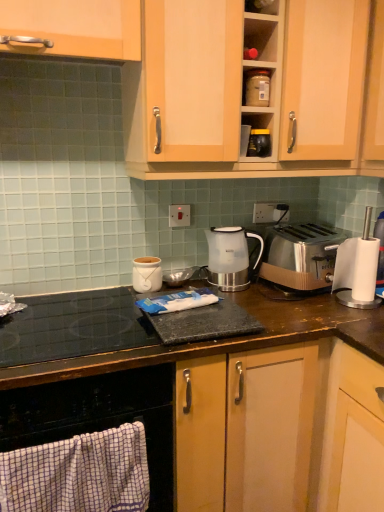
Measure the distance between point (75, 354) and camera.

The depth of point (75, 354) is 1.08 meters.

The width and height of the screenshot is (384, 512). Find the location of `black glass cooktop at lower left`. black glass cooktop at lower left is located at coordinates (73, 327).

Locate an element on the screen. The image size is (384, 512). black glass cooktop at lower left is located at coordinates (99, 416).

What do you see at coordinates (155, 336) in the screenshot? The width and height of the screenshot is (384, 512). I see `brown wood countertop at center` at bounding box center [155, 336].

The height and width of the screenshot is (512, 384). What do you see at coordinates (357, 269) in the screenshot?
I see `white plastic blender at right` at bounding box center [357, 269].

Looking at this image, what is the approximate width of wooden cabinet at upper center, which ranks as the 1th cabinetry in right-to-left order?

wooden cabinet at upper center, which ranks as the 1th cabinetry in right-to-left order, is 37.36 centimeters wide.

Image resolution: width=384 pixels, height=512 pixels. In order to click on satin silver outlet at center, acting as the 1th electric outlet starting from the back in this screenshot , I will do `click(270, 212)`.

Could matte plastic container at upper center, which ranks as the 1th kitchen appliance in right-to-left order, be considered to be inside white plastic blender at right?

No, matte plastic container at upper center, which ranks as the 1th kitchen appliance in right-to-left order, is located outside of white plastic blender at right.

From the image's perspective, which is below, white plastic blender at right or matte plastic container at upper center, which ranks as the 1th kitchen appliance in right-to-left order?

white plastic blender at right appears lower in the image.

Which of these two, white plastic blender at right or matte plastic container at upper center, which ranks as the 1th kitchen appliance in right-to-left order, is wider?

Wider between the two is white plastic blender at right.

Between white plastic blender at right and matte plastic container at upper center, which appears as the 3th kitchen appliance when viewed from the left, which one appears on the right side from the viewer's perspective?

Positioned to the right is white plastic blender at right.

Is satin silver toaster at right to the right of wooden cabinet handle at upper left, acting as the 2th cabinetry starting from the right, from the viewer's perspective?

Yes.

How far apart are satin silver toaster at right and wooden cabinet handle at upper left, acting as the 1th cabinetry starting from the left?

The distance of satin silver toaster at right from wooden cabinet handle at upper left, acting as the 1th cabinetry starting from the left, is 94.54 centimeters.

From a real-world perspective, relative to wooden cabinet handle at upper left, acting as the 1th cabinetry starting from the left, is satin silver toaster at right vertically above or below?

Clearly, from a real-world perspective, satin silver toaster at right is below wooden cabinet handle at upper left, acting as the 1th cabinetry starting from the left.

Who is taller, satin silver toaster at right or wooden cabinet handle at upper left, acting as the 2th cabinetry starting from the right?

wooden cabinet handle at upper left, acting as the 2th cabinetry starting from the right.

Would you say wooden cabinet at upper center, which ranks as the 2th cabinetry in left-to-right order, is inside or outside satin silver outlet at center, placed as the second electric outlet when sorted from left to right?

wooden cabinet at upper center, which ranks as the 2th cabinetry in left-to-right order, is outside satin silver outlet at center, placed as the second electric outlet when sorted from left to right.

Are wooden cabinet at upper center, which ranks as the 2th cabinetry in left-to-right order, and satin silver outlet at center, placed as the second electric outlet when sorted from left to right, located far from each other?

No, there isn't a large distance between wooden cabinet at upper center, which ranks as the 2th cabinetry in left-to-right order, and satin silver outlet at center, placed as the second electric outlet when sorted from left to right.

Is wooden cabinet at upper center, which ranks as the 1th cabinetry in right-to-left order, facing away from satin silver outlet at center, placed as the second electric outlet when sorted from left to right?

No, wooden cabinet at upper center, which ranks as the 1th cabinetry in right-to-left order, is not facing the opposite direction of satin silver outlet at center, placed as the second electric outlet when sorted from left to right.

Is matte plastic container at upper center, the third kitchen appliance in the bottom-to-top sequence, far away from matte white jar at center, acting as the first kitchen appliance starting from the bottom?

matte plastic container at upper center, the third kitchen appliance in the bottom-to-top sequence, is near matte white jar at center, acting as the first kitchen appliance starting from the bottom, not far away.

In terms of height, does matte plastic container at upper center, the third kitchen appliance in the bottom-to-top sequence, look taller or shorter compared to matte white jar at center, which appears as the 3th kitchen appliance when viewed from the right?

matte plastic container at upper center, the third kitchen appliance in the bottom-to-top sequence, is shorter than matte white jar at center, which appears as the 3th kitchen appliance when viewed from the right.

Between matte plastic container at upper center, which ranks as the 1th kitchen appliance in right-to-left order, and matte white jar at center, acting as the first kitchen appliance starting from the bottom, which one has smaller width?

matte plastic container at upper center, which ranks as the 1th kitchen appliance in right-to-left order, is thinner.

Looking at this image, is black glass cooktop at lower left positioned in front of matte plastic container at upper center, which ranks as the 1th kitchen appliance in right-to-left order?

Yes, it is in front of matte plastic container at upper center, which ranks as the 1th kitchen appliance in right-to-left order.

Considering the positions of objects black glass cooktop at lower left and matte plastic container at upper center, marked as the 1th kitchen appliance in a top-to-bottom arrangement, in the image provided, who is more to the left, black glass cooktop at lower left or matte plastic container at upper center, marked as the 1th kitchen appliance in a top-to-bottom arrangement,?

Positioned to the left is black glass cooktop at lower left.

Image resolution: width=384 pixels, height=512 pixels. There is a black glass cooktop at lower left. Identify the location of the 3rd kitchen appliance above it (from the image's perspective). (257, 87).

How far apart are black glass cooktop at lower left and matte plastic container at upper center, which ranks as the 1th kitchen appliance in right-to-left order?

black glass cooktop at lower left is 34.91 inches away from matte plastic container at upper center, which ranks as the 1th kitchen appliance in right-to-left order.

Locate an element on the screen. The width and height of the screenshot is (384, 512). the 2nd electric outlet behind the brown wood countertop at center, starting your count from the anchor is located at coordinates (270, 212).

Is satin silver outlet at center, placed as the second electric outlet when sorted from left to right, closer to the viewer compared to brown wood countertop at center?

No, it is behind brown wood countertop at center.

Is satin silver outlet at center, the 2th electric outlet in the front-to-back sequence, oriented away from brown wood countertop at center?

No.

In the scene shown: Can black glass cooktop at lower left be found inside wooden cabinet at upper center, which ranks as the 2th cabinetry in left-to-right order?

No, black glass cooktop at lower left is located outside of wooden cabinet at upper center, which ranks as the 2th cabinetry in left-to-right order.

Considering the positions of objects wooden cabinet at upper center, which ranks as the 1th cabinetry in right-to-left order, and black glass cooktop at lower left in the image provided, who is in front, wooden cabinet at upper center, which ranks as the 1th cabinetry in right-to-left order, or black glass cooktop at lower left?

black glass cooktop at lower left is in front.

Considering the relative sizes of wooden cabinet at upper center, which ranks as the 1th cabinetry in right-to-left order, and black glass cooktop at lower left in the image provided, is wooden cabinet at upper center, which ranks as the 1th cabinetry in right-to-left order, bigger than black glass cooktop at lower left?

Correct, wooden cabinet at upper center, which ranks as the 1th cabinetry in right-to-left order, is larger in size than black glass cooktop at lower left.

From the picture: How distant is wooden cabinet at upper center, which ranks as the 1th cabinetry in right-to-left order, from black glass cooktop at lower left?

wooden cabinet at upper center, which ranks as the 1th cabinetry in right-to-left order, and black glass cooktop at lower left are 27.01 inches apart.

What are the coordinates of `blender below the matte plastic container at upper center, which ranks as the 1th kitchen appliance in right-to-left order (from the image's perspective)` in the screenshot? It's located at (357, 269).

Where is `toaster behind the wooden cabinet handle at upper left, acting as the 1th cabinetry starting from the left`? The width and height of the screenshot is (384, 512). toaster behind the wooden cabinet handle at upper left, acting as the 1th cabinetry starting from the left is located at coordinates (301, 255).

Considering their positions, is satin silver outlet at center, placed as the second electric outlet when sorted from left to right, positioned further to white plastic electric outlet at center, the second electric outlet viewed from the right, than white plastic blender at right?

Based on the image, white plastic blender at right appears to be further to white plastic electric outlet at center, the second electric outlet viewed from the right.

When comparing their distances from satin silver outlet at center, placed as the second electric outlet when sorted from left to right, does white glossy electric kettle at center, the 2th kitchen appliance in the bottom-to-top sequence, or white plastic blender at right seem closer?

white glossy electric kettle at center, the 2th kitchen appliance in the bottom-to-top sequence.

Which object lies further to the anchor point wooden cabinet at upper center, which ranks as the 1th cabinetry in right-to-left order, wooden cabinet handle at upper left, acting as the 1th cabinetry starting from the left, or matte white jar at center, which appears as the 3th kitchen appliance when viewed from the right?

matte white jar at center, which appears as the 3th kitchen appliance when viewed from the right.

Based on their spatial positions, is black glass cooktop at lower left or black glass cooktop at lower left closer to wooden cabinet handle at upper left, acting as the 2th cabinetry starting from the right?

black glass cooktop at lower left lies closer to wooden cabinet handle at upper left, acting as the 2th cabinetry starting from the right, than the other object.

Which object lies nearer to the anchor point wooden cabinet at upper center, which ranks as the 2th cabinetry in left-to-right order, brown wood countertop at center or matte white jar at center, acting as the first kitchen appliance starting from the bottom?

brown wood countertop at center is closer to wooden cabinet at upper center, which ranks as the 2th cabinetry in left-to-right order.

When comparing their distances from wooden cabinet handle at upper left, acting as the 1th cabinetry starting from the left, does black glass cooktop at lower left or matte white jar at center, the first kitchen appliance when ordered from left to right, seem further?

The object further to wooden cabinet handle at upper left, acting as the 1th cabinetry starting from the left, is black glass cooktop at lower left.

When comparing their distances from white plastic electric outlet at center, positioned as the 1th electric outlet in front-to-back order, does wooden cabinet handle at upper left, acting as the 1th cabinetry starting from the left, or white glossy electric kettle at center, the second kitchen appliance positioned from the right, seem closer?

white glossy electric kettle at center, the second kitchen appliance positioned from the right, is closer to white plastic electric outlet at center, positioned as the 1th electric outlet in front-to-back order.

Looking at the image, which one is located closer to wooden cabinet handle at upper left, acting as the 1th cabinetry starting from the left, matte white jar at center, which is the third kitchen appliance from top to bottom, or wooden cabinet at upper center, which ranks as the 1th cabinetry in right-to-left order?

Among the two, wooden cabinet at upper center, which ranks as the 1th cabinetry in right-to-left order, is located nearer to wooden cabinet handle at upper left, acting as the 1th cabinetry starting from the left.

Where is `gas stove between wooden cabinet handle at upper left, acting as the 1th cabinetry starting from the left, and brown wood countertop at center vertically`? gas stove between wooden cabinet handle at upper left, acting as the 1th cabinetry starting from the left, and brown wood countertop at center vertically is located at coordinates 73,327.

At what (x,y) coordinates should I click in order to perform the action: click on electric outlet located between wooden cabinet handle at upper left, acting as the 2th cabinetry starting from the right, and satin silver outlet at center, which ranks as the first electric outlet in right-to-left order, in the depth direction. Please return your answer as a coordinate pair (x, y). This screenshot has height=512, width=384. Looking at the image, I should click on (179, 215).

Identify the location of toaster between matte plastic container at upper center, marked as the 1th kitchen appliance in a top-to-bottom arrangement, and black glass cooktop at lower left vertically. The width and height of the screenshot is (384, 512). (301, 255).

Where is `toaster between wooden cabinet at upper center, which ranks as the 2th cabinetry in left-to-right order, and black glass cooktop at lower left vertically`? toaster between wooden cabinet at upper center, which ranks as the 2th cabinetry in left-to-right order, and black glass cooktop at lower left vertically is located at coordinates (301, 255).